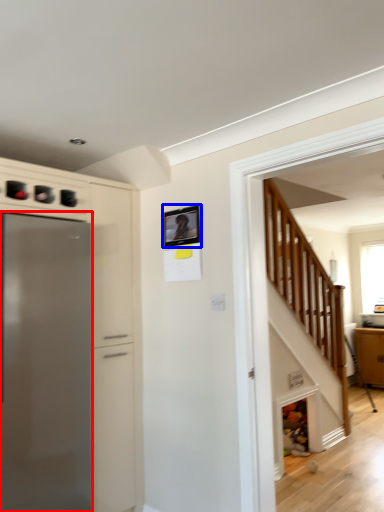
Question: Which object appears closest to the camera in this image, refrigerator (highlighted by a red box) or picture frame (highlighted by a blue box)?

Choices:
 (A) refrigerator
 (B) picture frame

Answer: (A)